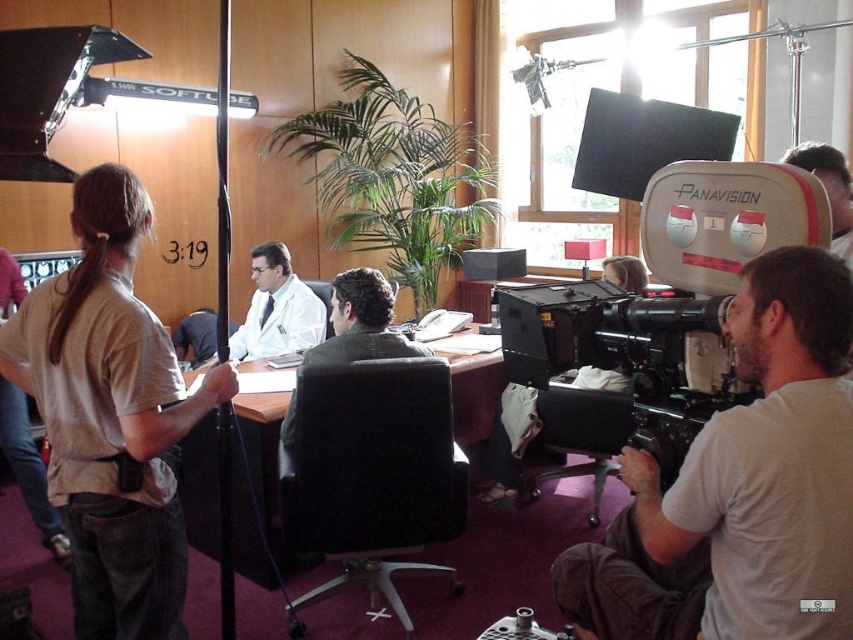
Describe the element at coordinates (741, 486) in the screenshot. I see `matte gray camera at right` at that location.

Is matte gray camera at right to the left of white matte coat at center from the viewer's perspective?

No, matte gray camera at right is not to the left of white matte coat at center.

Identify the location of matte gray camera at right. (741, 486).

Is matte gray camera at right above matte black panavision camera at right?

No.

Between matte gray camera at right and matte black panavision camera at right, which one appears on the right side from the viewer's perspective?

Positioned to the right is matte gray camera at right.

Identify the location of matte gray camera at right. This screenshot has width=853, height=640. (741, 486).

Does matte black panavision camera at right have a larger size compared to white matte coat at center?

Indeed, matte black panavision camera at right has a larger size compared to white matte coat at center.

Is matte black panavision camera at right in front of white matte coat at center?

Yes, it is in front of white matte coat at center.

The height and width of the screenshot is (640, 853). Identify the location of matte black panavision camera at right. (668, 296).